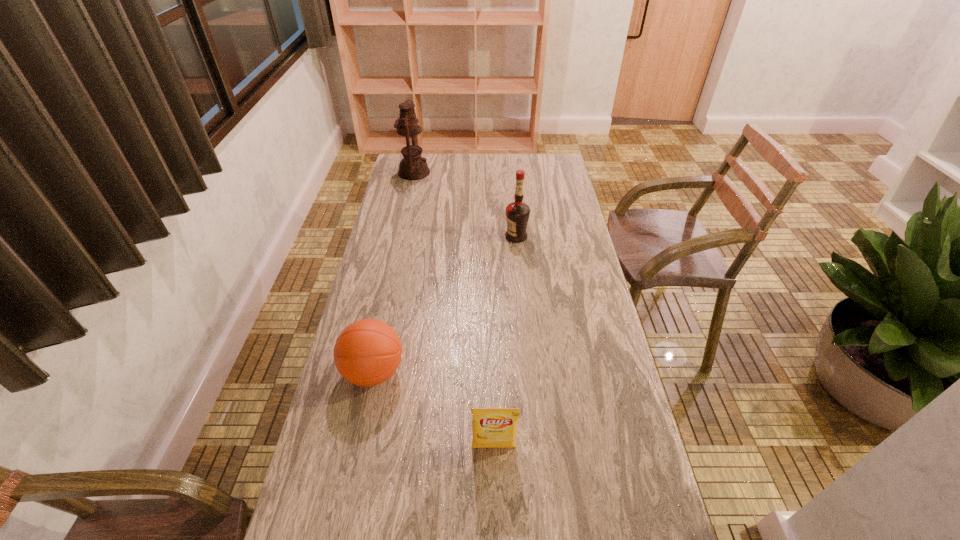
Where is `oil lamp`? oil lamp is located at coordinates click(412, 167).

Where is `the rightmost object`? The height and width of the screenshot is (540, 960). the rightmost object is located at coordinates (517, 213).

I want to click on liquor, so click(517, 213).

Where is `basketball`? The width and height of the screenshot is (960, 540). basketball is located at coordinates click(367, 352).

Where is `crisp (potato chip)`? Image resolution: width=960 pixels, height=540 pixels. crisp (potato chip) is located at coordinates (492, 427).

You are a GUI agent. You are given a task and a screenshot of the screen. Output one action in this format:
    pyautogui.click(x=<x>, y=<y>)
    Task: Click on the nearest object
    The height and width of the screenshot is (540, 960).
    Given the screenshot: What is the action you would take?
    pyautogui.click(x=492, y=427)

Locate an element on the screen. The image size is (960, 540). free spot located on the back of the oil lamp is located at coordinates (418, 154).

Identify the location of free space located 0.060m on the front and back of the liquor. (489, 237).

The height and width of the screenshot is (540, 960). What are the coordinates of `vacant space situated 0.290m on the front and back of the liquor` in the screenshot? It's located at (430, 237).

The image size is (960, 540). I want to click on vacant point located 0.360m on the front and back of the liquor, so click(x=412, y=237).